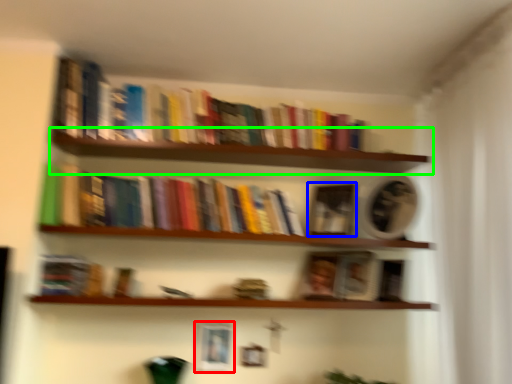
Question: Which is farther away from picture frame (highlighted by a red box)? paperback book (highlighted by a blue box) or shelf (highlighted by a green box)?

Choices:
 (A) paperback book
 (B) shelf

Answer: (B)